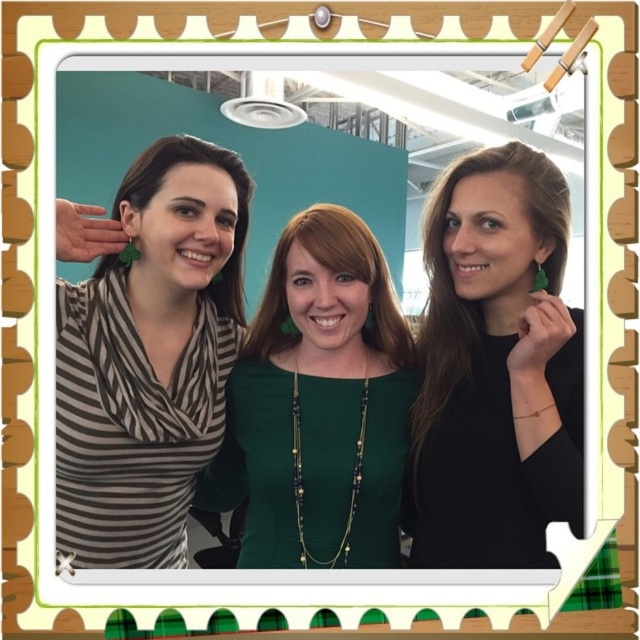
You are trying to decide which outfit to wear for an event. You see the green matte dress at center and the brownhair at left in the image. Which outfit would be more appropriate for a formal event?

The green matte dress at center is more appropriate for a formal event because it is a dress, which is typically more formal than casual attire like the top worn by brownhair at left.

You are a photographer at the event and want to ensure the striped fabric scarf at left and brownhair at left are both visible in the photo. Which object should you focus on to make sure both are in frame?

The striped fabric scarf at left is in front of brownhair at left, so focusing on the striped fabric scarf at left will ensure both are visible since it is closer to the camera.